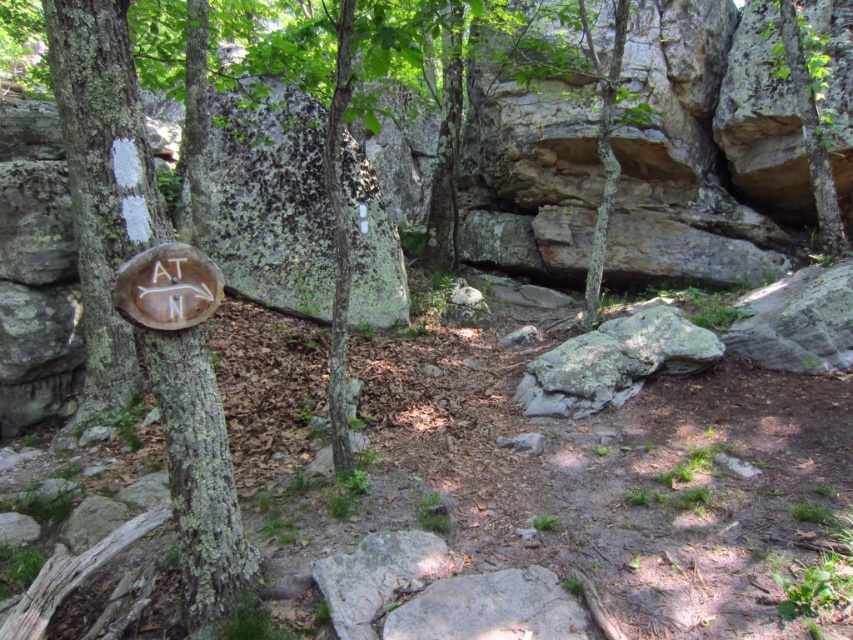
Question: Among these objects, which one is farthest from the camera?

Choices:
 (A) green rough bark at left
 (B) green rough bark tree at upper right

Answer: (B)

Question: Which point appears farthest from the camera in this image?

Choices:
 (A) (782, 44)
 (B) (100, 90)
 (C) (85, 29)

Answer: (A)

Question: Observing the image, what is the correct spatial positioning of brown wood sign at left in reference to green rough bark tree at upper right?

Choices:
 (A) right
 (B) left

Answer: (B)

Question: Is brown wood sign at left to the left of green rough bark at left from the viewer's perspective?

Choices:
 (A) no
 (B) yes

Answer: (A)

Question: Can you confirm if green rough bark at left is thinner than green rough bark tree at upper right?

Choices:
 (A) no
 (B) yes

Answer: (A)

Question: Which of the following is the closest to the observer?

Choices:
 (A) green rough bark at left
 (B) green rough bark tree at upper right

Answer: (A)